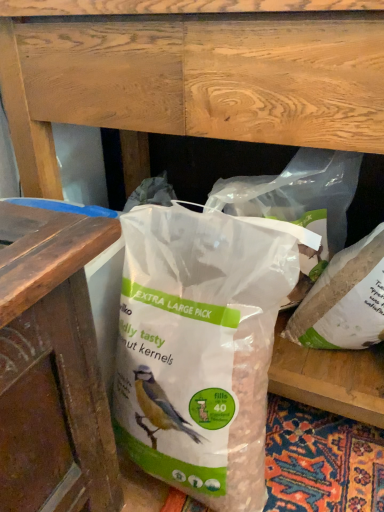
Question: Can translucent plastic bag at center, marked as the second plastic bag in a left-to-right arrangement, be found inside white matte plastic bag at center, the third plastic bag in the left-to-right sequence?

Choices:
 (A) no
 (B) yes

Answer: (A)

Question: Considering the relative sizes of white matte plastic bag at center, the third plastic bag in the left-to-right sequence, and translucent plastic bag at center, the 2th plastic bag positioned from the right, in the image provided, is white matte plastic bag at center, the third plastic bag in the left-to-right sequence, wider than translucent plastic bag at center, the 2th plastic bag positioned from the right,?

Choices:
 (A) no
 (B) yes

Answer: (A)

Question: Is white matte plastic bag at center, arranged as the 1th plastic bag when viewed from the right, with translucent plastic bag at center, marked as the second plastic bag in a left-to-right arrangement?

Choices:
 (A) no
 (B) yes

Answer: (A)

Question: Is white matte plastic bag at center, the third plastic bag in the left-to-right sequence, to the right of translucent plastic bag at center, the 2th plastic bag positioned from the right, from the viewer's perspective?

Choices:
 (A) yes
 (B) no

Answer: (A)

Question: Considering the relative sizes of white matte plastic bag at center, arranged as the 1th plastic bag when viewed from the right, and translucent plastic bag at center, the 2th plastic bag positioned from the right, in the image provided, is white matte plastic bag at center, arranged as the 1th plastic bag when viewed from the right, shorter than translucent plastic bag at center, the 2th plastic bag positioned from the right,?

Choices:
 (A) no
 (B) yes

Answer: (B)

Question: Looking at the image, does translucent plastic bag at center, the first plastic bag positioned from the left, seem bigger or smaller compared to white matte plastic bag at center, the third plastic bag in the left-to-right sequence?

Choices:
 (A) small
 (B) big

Answer: (B)

Question: In terms of width, does translucent plastic bag at center, placed as the 3th plastic bag when sorted from right to left, look wider or thinner when compared to white matte plastic bag at center, arranged as the 1th plastic bag when viewed from the right?

Choices:
 (A) thin
 (B) wide

Answer: (B)

Question: Visually, is translucent plastic bag at center, placed as the 3th plastic bag when sorted from right to left, positioned to the left or to the right of white matte plastic bag at center, arranged as the 1th plastic bag when viewed from the right?

Choices:
 (A) right
 (B) left

Answer: (B)

Question: Is point (236, 366) positioned closer to the camera than point (355, 284)?

Choices:
 (A) farther
 (B) closer

Answer: (B)

Question: From a real-world perspective, is translucent plastic bag at center, the first plastic bag positioned from the left, above or below translucent plastic bag at center, the 2th plastic bag positioned from the right?

Choices:
 (A) above
 (B) below

Answer: (B)

Question: Does point (168, 344) appear closer or farther from the camera than point (339, 234)?

Choices:
 (A) closer
 (B) farther

Answer: (A)

Question: Which is correct: translucent plastic bag at center, the first plastic bag positioned from the left, is inside translucent plastic bag at center, marked as the second plastic bag in a left-to-right arrangement, or outside of it?

Choices:
 (A) inside
 (B) outside

Answer: (B)

Question: Is translucent plastic bag at center, the first plastic bag positioned from the left, taller or shorter than translucent plastic bag at center, the 2th plastic bag positioned from the right?

Choices:
 (A) tall
 (B) short

Answer: (A)

Question: From a real-world perspective, is translucent plastic bag at center, the 2th plastic bag positioned from the right, positioned above or below translucent plastic bag at center, placed as the 3th plastic bag when sorted from right to left?

Choices:
 (A) below
 (B) above

Answer: (B)

Question: Would you say translucent plastic bag at center, the 2th plastic bag positioned from the right, is to the left or to the right of translucent plastic bag at center, the first plastic bag positioned from the left, in the picture?

Choices:
 (A) right
 (B) left

Answer: (A)